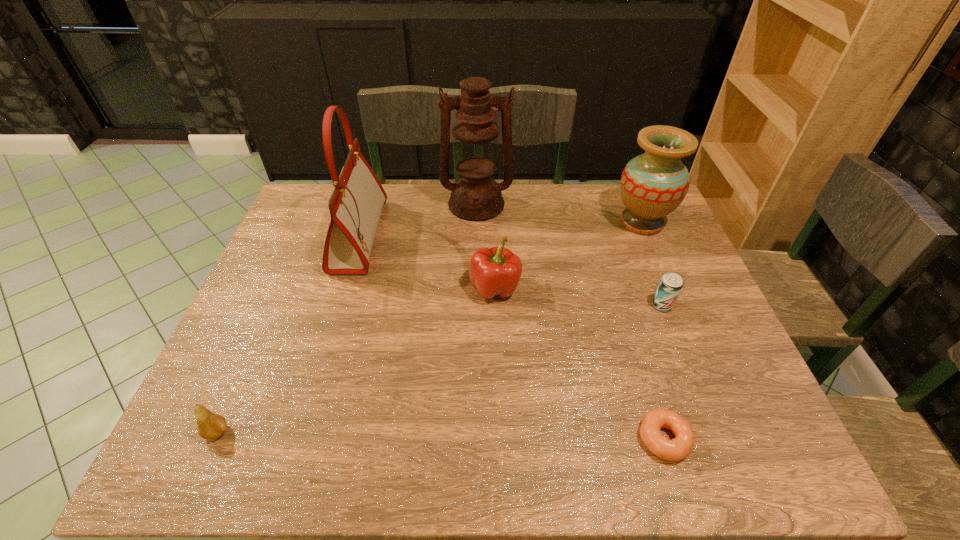
Find the location of a particular element. oil lamp is located at coordinates (476, 196).

Find the location of a particular element. The image size is (960, 540). the sixth object from right to left is located at coordinates (356, 204).

Locate an element on the screen. This screenshot has width=960, height=540. vase is located at coordinates (653, 184).

Locate an element on the screen. pepper is located at coordinates (493, 272).

The image size is (960, 540). In order to click on beer can in this screenshot , I will do `click(671, 284)`.

Locate an element on the screen. Image resolution: width=960 pixels, height=540 pixels. the leftmost object is located at coordinates (210, 425).

You are a GUI agent. You are given a task and a screenshot of the screen. Output one action in this format:
    pyautogui.click(x=<x>, y=<y>)
    Task: Click on the shortest object
    
    Given the screenshot: What is the action you would take?
    pyautogui.click(x=679, y=448)

Locate an element on the screen. Image resolution: width=960 pixels, height=540 pixels. vacant region located on the right of the oil lamp is located at coordinates (604, 205).

The height and width of the screenshot is (540, 960). In order to click on free location located 0.350m on the front of the handbag in this screenshot , I will do `click(314, 384)`.

What are the coordinates of `free location located on the front of the third tallest object` in the screenshot? It's located at (694, 349).